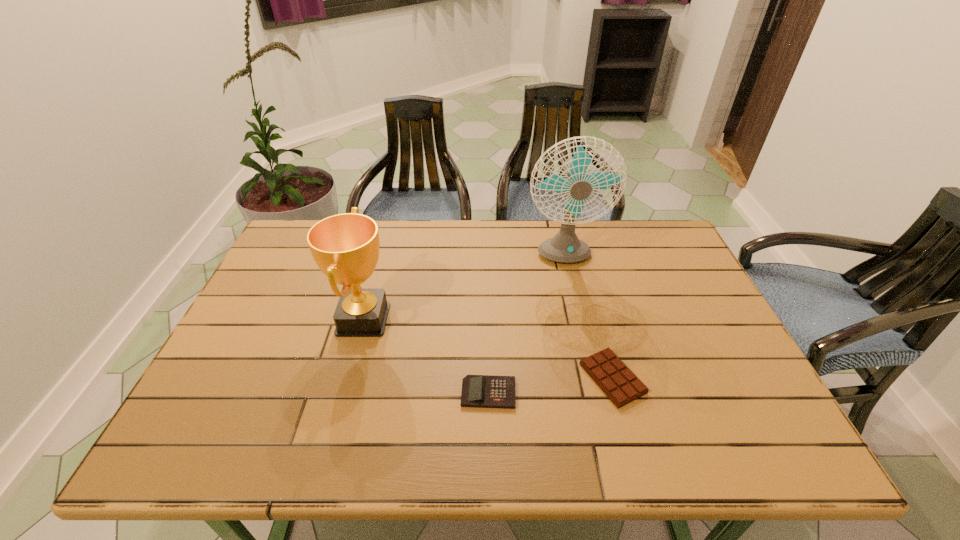
In order to click on free location that satisfies the following two spatial constraints: 1. on the front-facing side of the farthest object; 2. on the front-facing side of the leftmost object in this screenshot , I will do tap(576, 319).

The height and width of the screenshot is (540, 960). In order to click on free space that satisfies the following two spatial constraints: 1. on the front-facing side of the second tallest object; 2. on the left side of the candy bar in this screenshot , I will do 348,378.

The width and height of the screenshot is (960, 540). I want to click on blank space that satisfies the following two spatial constraints: 1. on the front-facing side of the award; 2. on the left side of the calculator, so click(x=344, y=393).

You are a GUI agent. You are given a task and a screenshot of the screen. Output one action in this format:
    pyautogui.click(x=<x>, y=<y>)
    Task: Click on the vacant space that satisfies the following two spatial constraints: 1. on the front-facing side of the fan; 2. on the front-facing side of the award
    The width and height of the screenshot is (960, 540).
    Given the screenshot: What is the action you would take?
    pyautogui.click(x=576, y=319)

Find the location of a particular element. free space that satisfies the following two spatial constraints: 1. on the front-facing side of the third shortest object; 2. on the right side of the calculator is located at coordinates (344, 393).

Where is `vacant space that satisfies the following two spatial constraints: 1. on the back side of the second object from left to right; 2. on the right side of the candy bar`? The height and width of the screenshot is (540, 960). vacant space that satisfies the following two spatial constraints: 1. on the back side of the second object from left to right; 2. on the right side of the candy bar is located at coordinates (489, 378).

Where is `free space that satisfies the following two spatial constraints: 1. on the front-facing side of the tallest object; 2. on the right side of the candy bar`? Image resolution: width=960 pixels, height=540 pixels. free space that satisfies the following two spatial constraints: 1. on the front-facing side of the tallest object; 2. on the right side of the candy bar is located at coordinates (589, 378).

Find the location of a particular element. The image size is (960, 540). free space that satisfies the following two spatial constraints: 1. on the front-facing side of the farthest object; 2. on the front-facing side of the third shortest object is located at coordinates (576, 319).

Image resolution: width=960 pixels, height=540 pixels. What are the coordinates of `free space that satisfies the following two spatial constraints: 1. on the front-facing side of the award; 2. on the left side of the third object from right to left` in the screenshot? It's located at (344, 393).